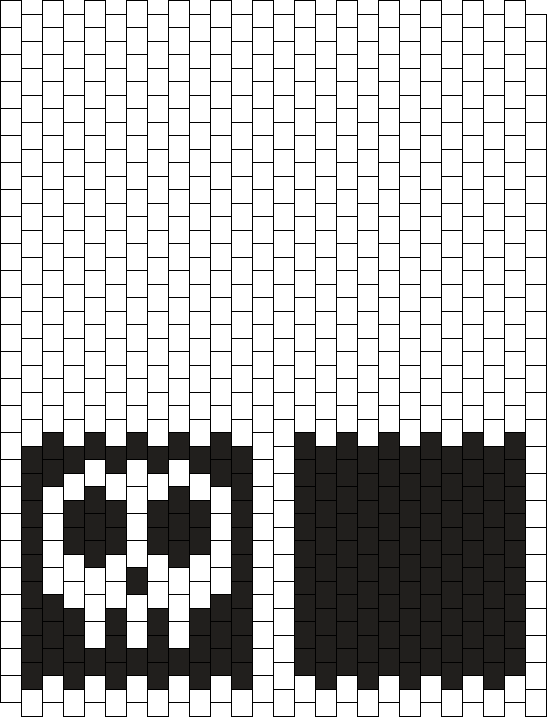
Identify the location of lower left white tile corner. This screenshot has height=717, width=547. (7, 695), (28, 706).